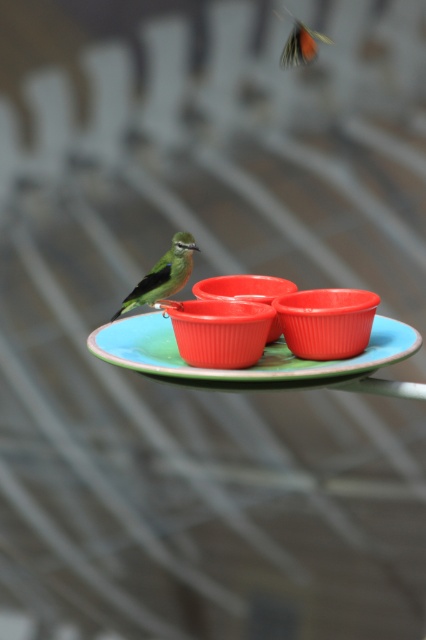
Between point (112, 353) and point (131, 305), which one is positioned in front?

Point (112, 353)

Does matte plastic plate at center appear on the left side of green matte bird at center?

Incorrect, matte plastic plate at center is not on the left side of green matte bird at center.

Measure the distance between matte plastic plate at center and camera.

matte plastic plate at center and camera are 34.49 inches apart.

The width and height of the screenshot is (426, 640). Identify the location of matte plastic plate at center. pos(245,368).